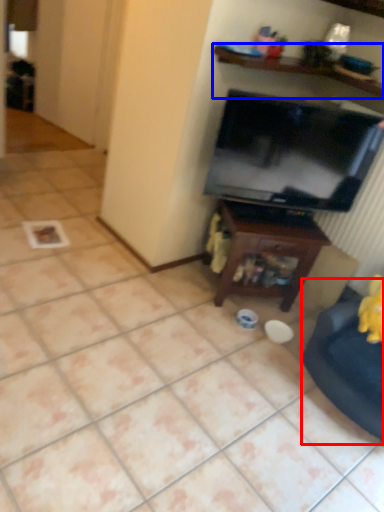
Question: Which object is closer to the camera taking this photo, swivel chair (highlighted by a red box) or shelf (highlighted by a blue box)?

Choices:
 (A) swivel chair
 (B) shelf

Answer: (A)